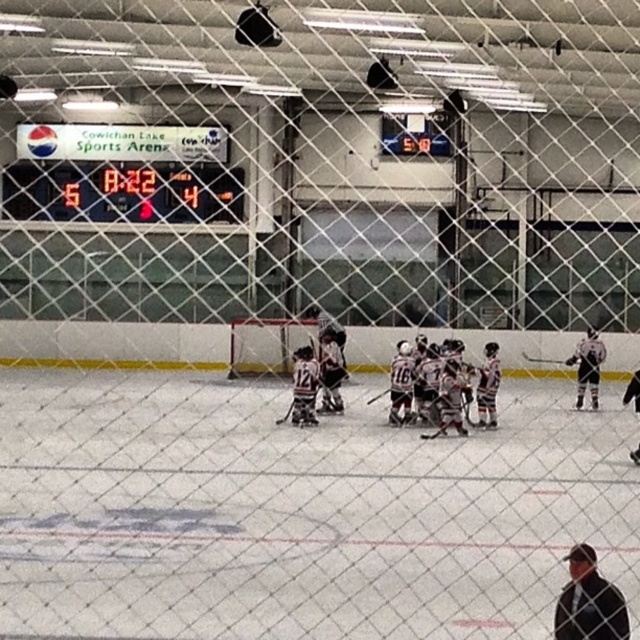
You are a photographer trying to capture the entire hockey game scene. Considering the white ice at center and the digital display scoreboard at upper left, which object would require a wider angle lens to include in your shot?

The white ice at center is bigger than the digital display scoreboard at upper left, so you would need a wider angle lens to capture the white ice at center in its entirety.

You are a spectator sitting in the Cowichan Lake Sports Arena watching the hockey game. You notice the white ice at center and the digital display scoreboard at upper left. Which object is located lower in the image?

The white ice at center is located below the digital display scoreboard at upper left, so the white ice at center is lower in the image.